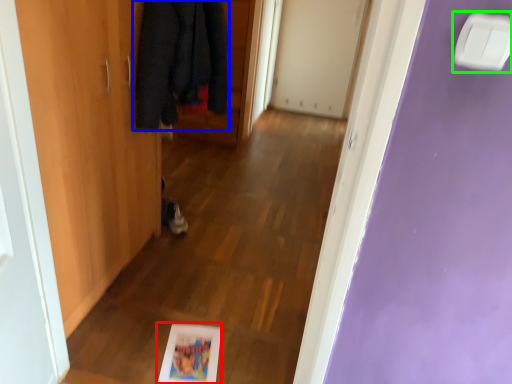
Question: Estimate the real-world distances between objects in this image. Which object is closer to picture frame (highlighted by a red box), cloak (highlighted by a blue box) or light switch (highlighted by a green box)?

Choices:
 (A) cloak
 (B) light switch

Answer: (A)